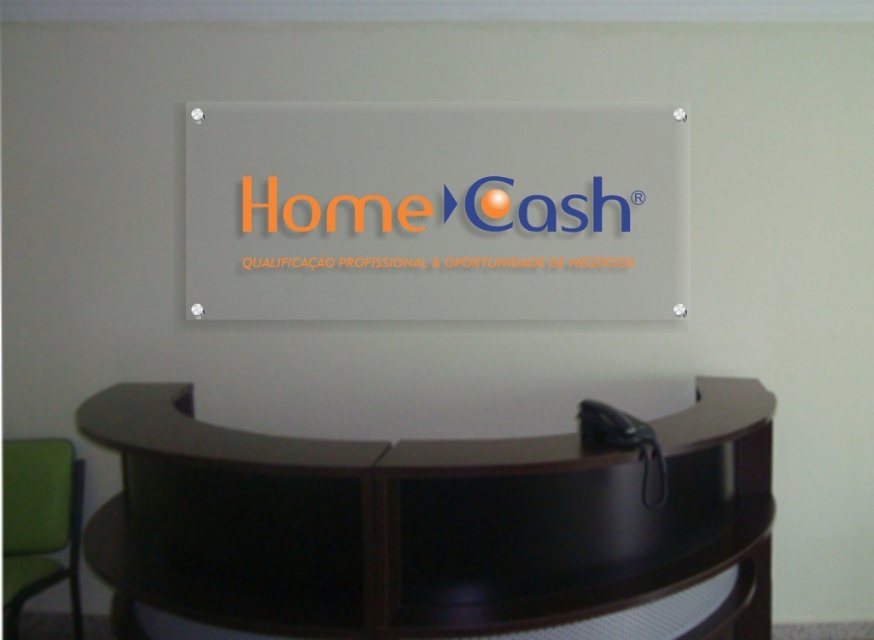
Question: Based on their relative distances, which object is nearer to the dark wood/finish reception desk at center?

Choices:
 (A) transparent acrylic sign at center
 (B) green fabric chair at lower left

Answer: (A)

Question: Where is dark wood/finish reception desk at center located in relation to black leather phone at lower right in the image?

Choices:
 (A) above
 (B) below

Answer: (B)

Question: Among these points, which one is nearest to the camera?

Choices:
 (A) (36, 481)
 (B) (702, 634)
 (C) (324, 176)
 (D) (642, 422)

Answer: (D)

Question: Where is dark wood/finish reception desk at center located in relation to green fabric chair at lower left in the image?

Choices:
 (A) below
 (B) above

Answer: (B)

Question: Does transparent acrylic sign at center appear under black leather phone at lower right?

Choices:
 (A) no
 (B) yes

Answer: (A)

Question: Which is farther from the transparent acrylic sign at center?

Choices:
 (A) black leather phone at lower right
 (B) green fabric chair at lower left
 (C) dark wood/finish reception desk at center

Answer: (B)